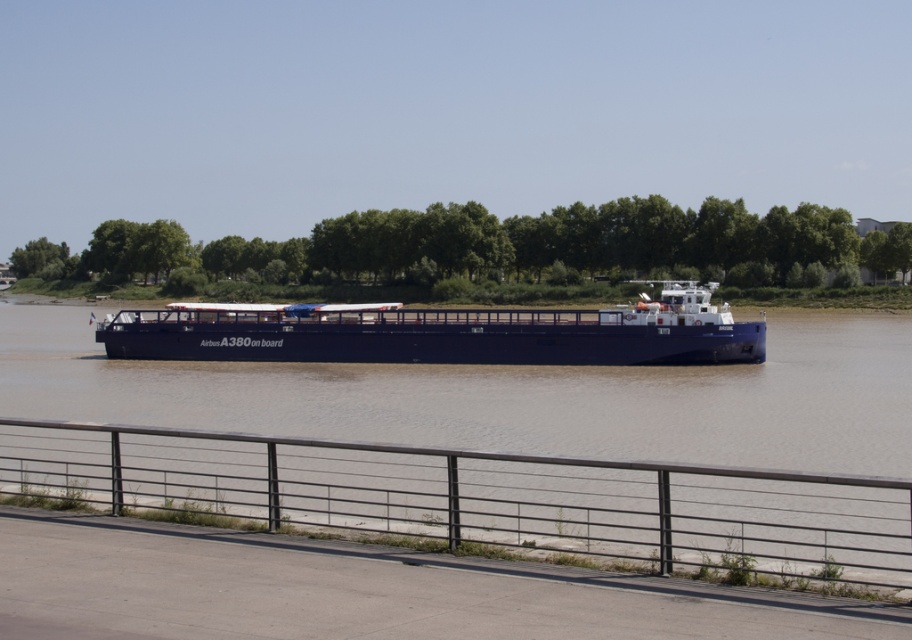
Question: Does metal fence at lower center have a larger size compared to blue matte cargo ship at center?

Choices:
 (A) no
 (B) yes

Answer: (A)

Question: Can you confirm if metal fence at lower center is wider than blue matte cargo ship at center?

Choices:
 (A) no
 (B) yes

Answer: (A)

Question: Among these points, which one is nearest to the camera?

Choices:
 (A) (814, 508)
 (B) (371, 307)

Answer: (A)

Question: Which object appears closest to the camera in this image?

Choices:
 (A) metal fence at lower center
 (B) blue matte cargo ship at center

Answer: (A)

Question: Is metal fence at lower center above blue matte cargo ship at center?

Choices:
 (A) yes
 (B) no

Answer: (B)